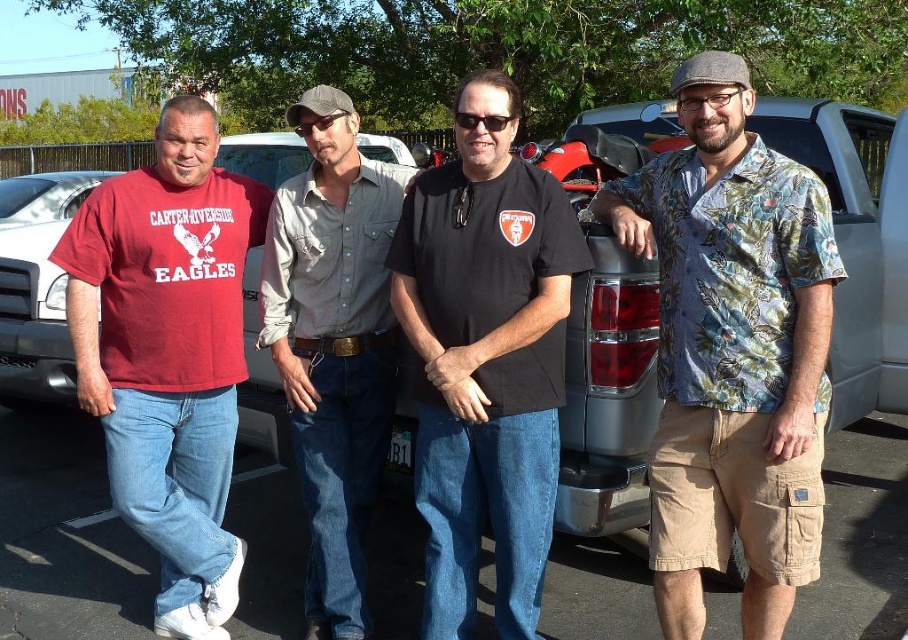
Question: Which point is farther to the camera?

Choices:
 (A) black matte t-shirt at center
 (B) metallic silver pickup truck at right

Answer: (A)

Question: Is denim jeans at center positioned behind glossy plastic glasses at upper center?

Choices:
 (A) no
 (B) yes

Answer: (B)

Question: Estimate the real-world distances between objects in this image. Which object is closer to the black plastic sunglasses at center?

Choices:
 (A) glossy plastic glasses at upper center
 (B) brown denim pants at lower center
 (C) black matte t-shirt at center

Answer: (A)

Question: Among these points, which one is farthest from the camera?

Choices:
 (A) (147, 506)
 (B) (461, 609)
 (C) (786, 570)
 (D) (90, 618)

Answer: (D)

Question: Does brown denim pants at lower center have a lesser width compared to glossy plastic glasses at upper center?

Choices:
 (A) yes
 (B) no

Answer: (B)

Question: Does denim jeans at center have a larger size compared to black plastic sunglasses at center?

Choices:
 (A) yes
 (B) no

Answer: (A)